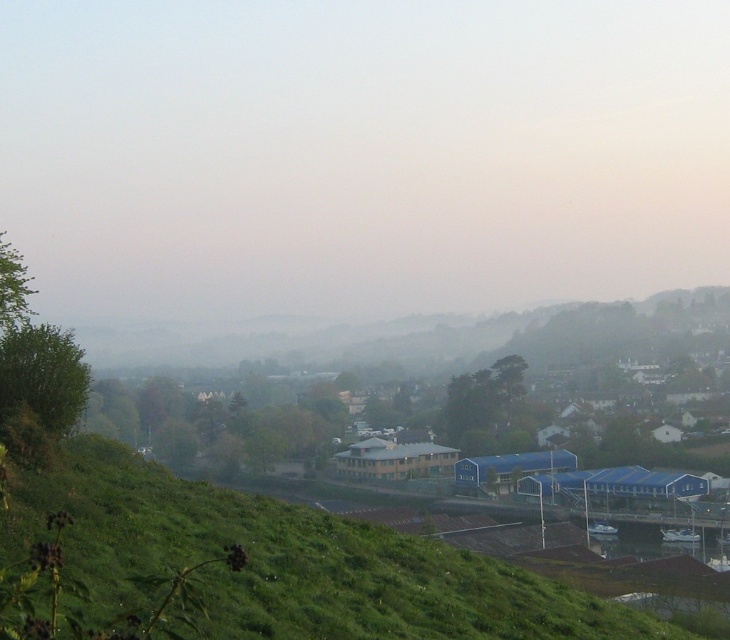
You are standing on the green grassy hillside at lower center and want to walk towards the foggy haze at center. Which direction should you head?

You should head to the right since the foggy haze at center is to the right of green grassy hillside at lower center.

You are an environmental scientist assessing the landscape. You notice the foggy haze at center and the green grassy hillside at lower center. Which of these two features occupies a greater area in the scene?

The foggy haze at center has a larger size compared to the green grassy hillside at lower center, so it occupies a greater area in the scene.

You are a hiker standing on the green grassy hillside at lower center. You want to see the buildings in the middle ground clearly. Can you see them through the foggy haze at center?

The foggy haze at center is much taller than the green grassy hillside at lower center, so the haze would block your view of the buildings in the middle ground.